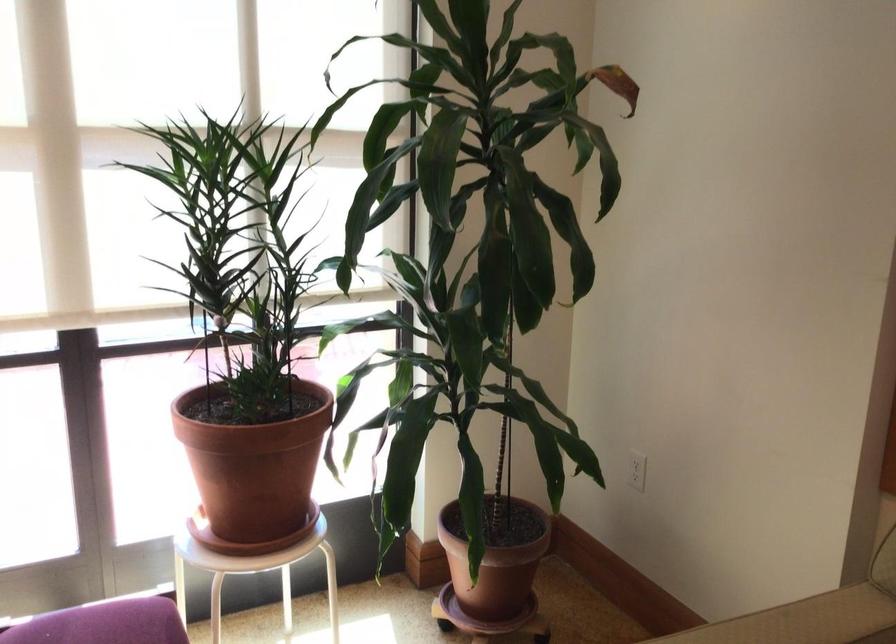
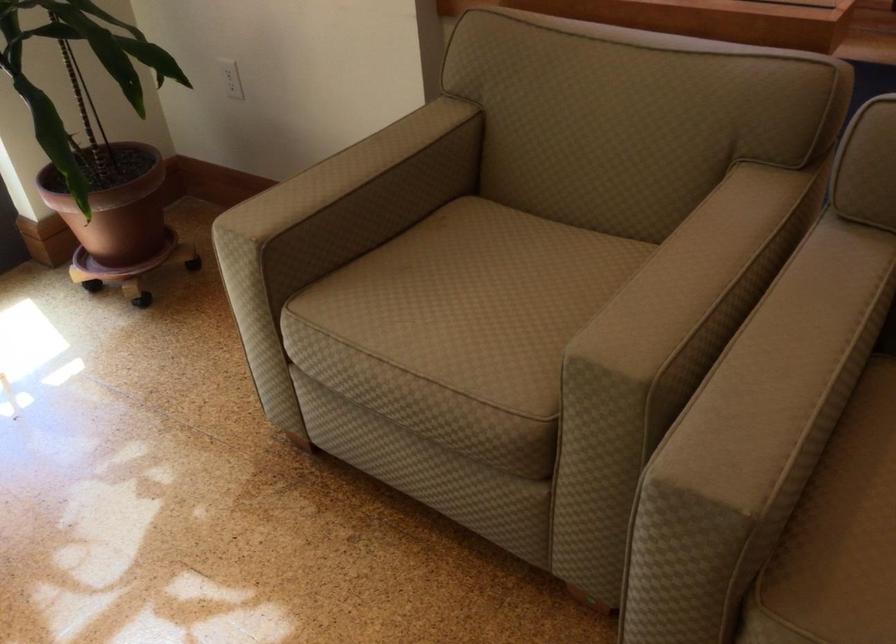
Locate, in the second image, the point that corresponds to pixel 493 567 in the first image.

(116, 210)